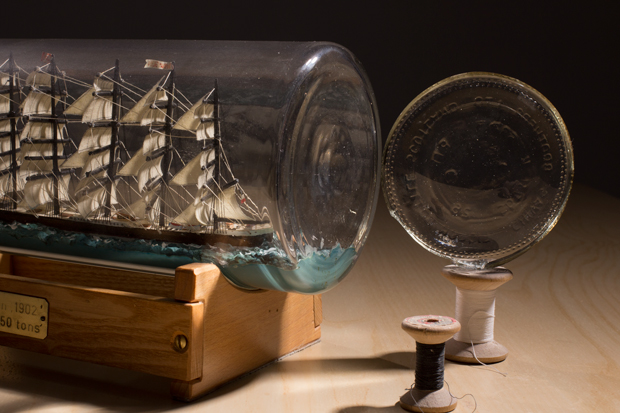
Find the location of a particular element. round glass piece is located at coordinates (505, 158).